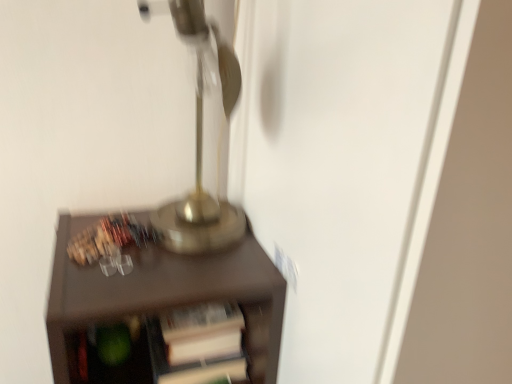
Question: From a real-world perspective, is brown matte cabinet at center positioned above or below gold metallic table lamp at upper center?

Choices:
 (A) below
 (B) above

Answer: (A)

Question: Is brown matte cabinet at center in front of or behind gold metallic table lamp at upper center in the image?

Choices:
 (A) front
 (B) behind

Answer: (B)

Question: Looking at their shapes, would you say brown matte cabinet at center is wider or thinner than gold metallic table lamp at upper center?

Choices:
 (A) thin
 (B) wide

Answer: (B)

Question: Considering the positions of gold metallic table lamp at upper center and brown matte cabinet at center in the image, is gold metallic table lamp at upper center wider or thinner than brown matte cabinet at center?

Choices:
 (A) wide
 (B) thin

Answer: (B)

Question: Is point (166, 11) closer or farther from the camera than point (190, 276)?

Choices:
 (A) farther
 (B) closer

Answer: (A)

Question: From the image's perspective, is gold metallic table lamp at upper center located above or below brown matte cabinet at center?

Choices:
 (A) above
 (B) below

Answer: (A)

Question: From a real-world perspective, is gold metallic table lamp at upper center positioned above or below brown matte cabinet at center?

Choices:
 (A) below
 (B) above

Answer: (B)